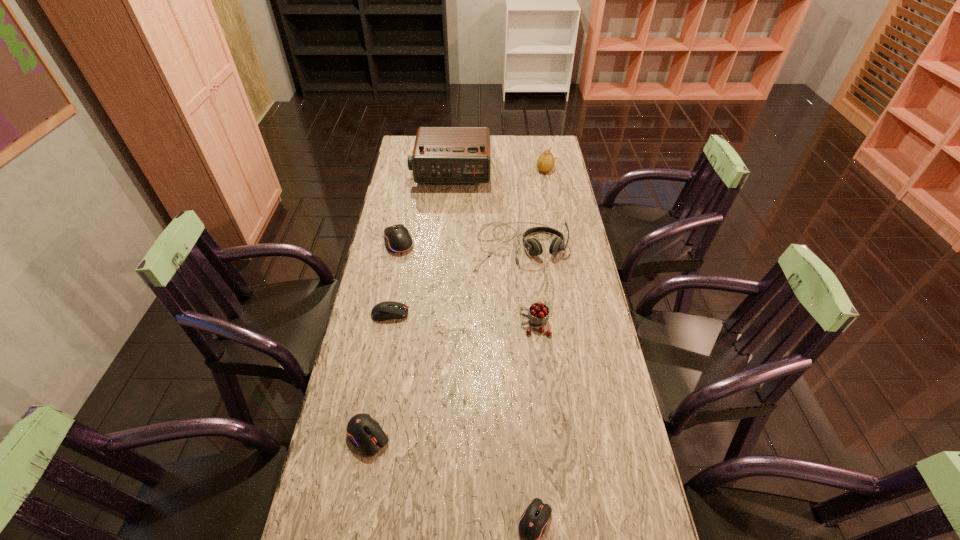
Find the location of a particular element. This screenshot has height=540, width=960. brown radio receiver is located at coordinates pos(441,154).

At what (x,y) coordinates should I click in order to perform the action: click on radio receiver. Please return your answer as a coordinate pair (x, y). Looking at the image, I should click on (441, 154).

Identify the location of pear. The width and height of the screenshot is (960, 540). (545, 163).

This screenshot has width=960, height=540. Identify the location of cherry. (538, 315).

This screenshot has height=540, width=960. I want to click on headset, so click(x=532, y=245).

Find the location of a particular element. This screenshot has width=960, height=540. the fourth shortest object is located at coordinates (398, 239).

Locate an element on the screen. The height and width of the screenshot is (540, 960). the farthest black computer mouse is located at coordinates (398, 239).

This screenshot has width=960, height=540. Find the location of `the sixth tallest object`. the sixth tallest object is located at coordinates (364, 432).

The height and width of the screenshot is (540, 960). In order to click on the second smallest black computer mouse in this screenshot , I will do `click(364, 432)`.

Where is `the third nearest computer mouse`? Image resolution: width=960 pixels, height=540 pixels. the third nearest computer mouse is located at coordinates (387, 310).